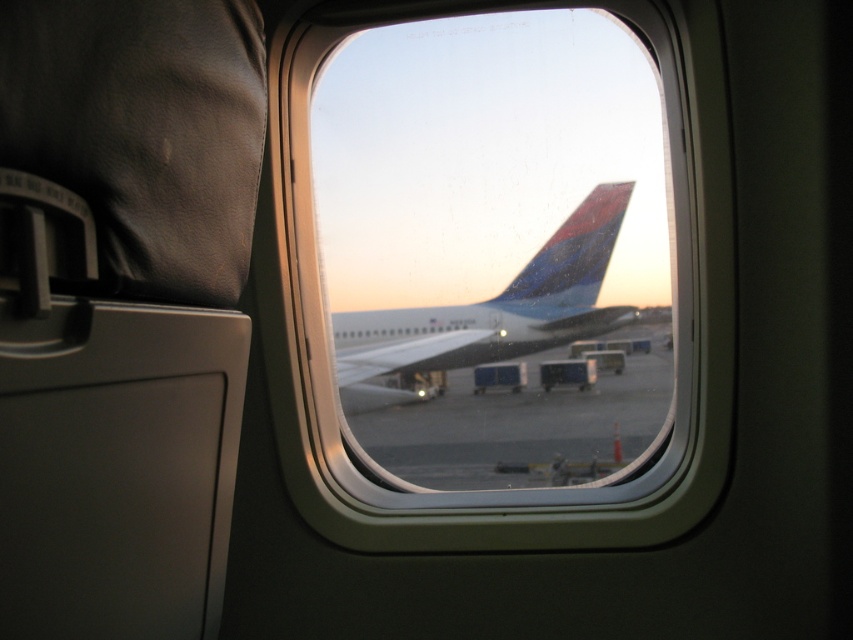
Which is behind, point (666, 356) or point (529, 340)?

Positioned behind is point (666, 356).

Based on the photo, does transparent glass airplane window at center have a lesser width compared to metallic blue airplane at center?

No.

Is point (567, 48) behind point (491, 348)?

No.

You are a GUI agent. You are given a task and a screenshot of the screen. Output one action in this format:
    pyautogui.click(x=<x>, y=<y>)
    Task: Click on the transparent glass airplane window at center
    Image resolution: width=853 pixels, height=640 pixels.
    Given the screenshot: What is the action you would take?
    pyautogui.click(x=494, y=252)

Does transparent glass airplane window at center have a lesser height compared to smooth concrete tarmac at center?

No, transparent glass airplane window at center is not shorter than smooth concrete tarmac at center.

Does point (368, 342) lie behind point (523, 368)?

Yes, point (368, 342) is farther from viewer.

You are a GUI agent. You are given a task and a screenshot of the screen. Output one action in this format:
    pyautogui.click(x=<x>, y=<y>)
    Task: Click on the transparent glass airplane window at center
    The image size is (853, 640).
    Given the screenshot: What is the action you would take?
    pyautogui.click(x=494, y=252)

Does smooth concrete tarmac at center lie behind metallic blue airplane at center?

No.

This screenshot has height=640, width=853. Describe the element at coordinates (518, 417) in the screenshot. I see `smooth concrete tarmac at center` at that location.

Locate an element on the screen. The image size is (853, 640). smooth concrete tarmac at center is located at coordinates (x=518, y=417).